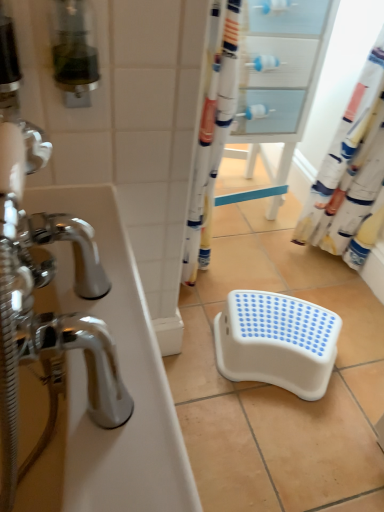
Locate an element on the screen. This screenshot has height=512, width=384. vacant area that is in front of white plastic step stool at center is located at coordinates (283, 439).